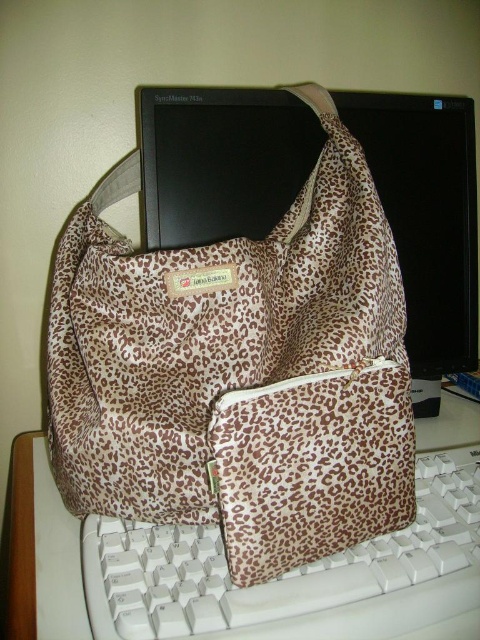
Is point (309, 305) more distant than point (153, 150)?

No, it is in front of (153, 150).

Identify the location of leopard print fabric bag at center. (240, 372).

At what (x,y) coordinates should I click in order to perform the action: click on leopard print fabric bag at center. Please return your answer as a coordinate pair (x, y). Image resolution: width=480 pixels, height=640 pixels. Looking at the image, I should click on (240, 372).

From the picture: Can you confirm if leopard print fabric bag at center is bigger than white plastic keyboard at lower center?

Actually, leopard print fabric bag at center might be smaller than white plastic keyboard at lower center.

Is point (277, 378) in front of point (28, 557)?

That is True.

What do you see at coordinates (240, 372) in the screenshot?
I see `leopard print fabric bag at center` at bounding box center [240, 372].

Identify the location of leopard print fabric bag at center. [x=240, y=372].

Describe the element at coordinates (427, 221) in the screenshot. I see `black glossy monitor at upper center` at that location.

At what (x,y) coordinates should I click in order to perform the action: click on black glossy monitor at upper center. Please return your answer as a coordinate pair (x, y). Looking at the image, I should click on (427, 221).